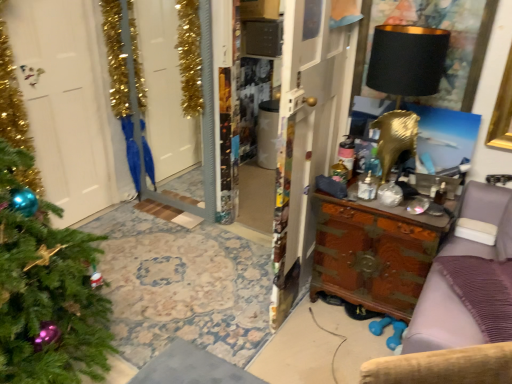
Find the location of a particular element. The width and height of the screenshot is (512, 384). free location in front of wooden chest at right is located at coordinates (337, 347).